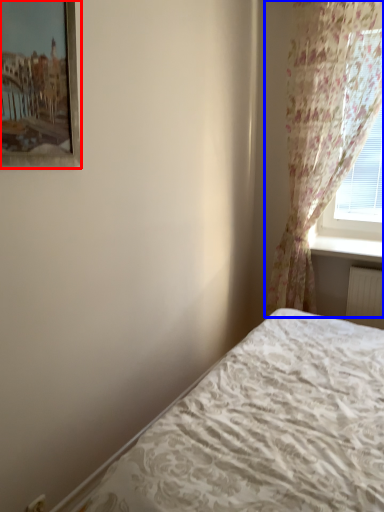
Question: Which object is further to the camera taking this photo, picture frame (highlighted by a red box) or curtain (highlighted by a blue box)?

Choices:
 (A) picture frame
 (B) curtain

Answer: (B)